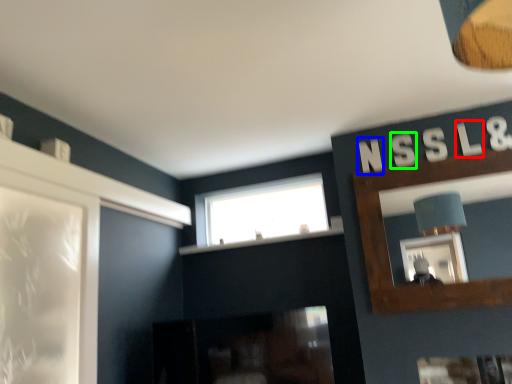
Question: Based on their relative distances, which object is farther from letter (highlighted by a red box)? Choose from letter (highlighted by a blue box) and letter (highlighted by a green box).

Choices:
 (A) letter
 (B) letter

Answer: (A)